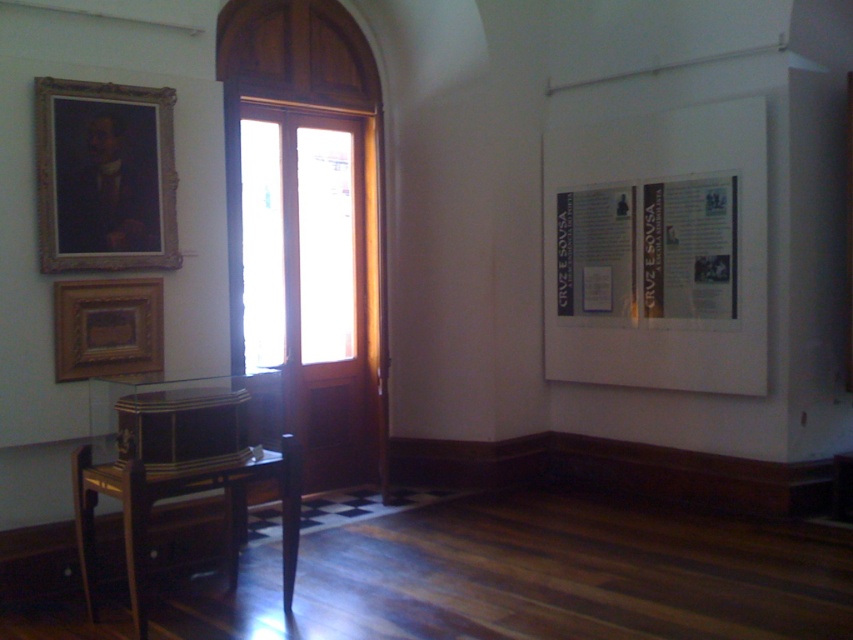
Does gold-framed portrait at upper left have a lesser width compared to wooden picture frame at lower left?

Incorrect, gold-framed portrait at upper left's width is not less than wooden picture frame at lower left's.

Where is `gold-framed portrait at upper left`? The height and width of the screenshot is (640, 853). gold-framed portrait at upper left is located at coordinates (105, 176).

Between clear glass door at center and wooden polished stool at lower left, which one appears on the right side from the viewer's perspective?

From the viewer's perspective, clear glass door at center appears more on the right side.

Does clear glass door at center appear under wooden polished stool at lower left?

Incorrect, clear glass door at center is not positioned below wooden polished stool at lower left.

Does point (254, 332) lie in front of point (79, 548)?

No, (254, 332) is further to viewer.

Find the location of a particular element. This screenshot has width=853, height=640. clear glass door at center is located at coordinates (299, 236).

Is gold-framed portrait at upper left positioned behind wooden polished stool at lower left?

That is True.

Between point (102, 163) and point (135, 573), which one is positioned behind?

The point (102, 163) is more distant.

You are a GUI agent. You are given a task and a screenshot of the screen. Output one action in this format:
    pyautogui.click(x=<x>, y=<y>)
    Task: Click on the gold-framed portrait at upper left
    
    Given the screenshot: What is the action you would take?
    pyautogui.click(x=105, y=176)

Image resolution: width=853 pixels, height=640 pixels. I want to click on gold-framed portrait at upper left, so click(x=105, y=176).